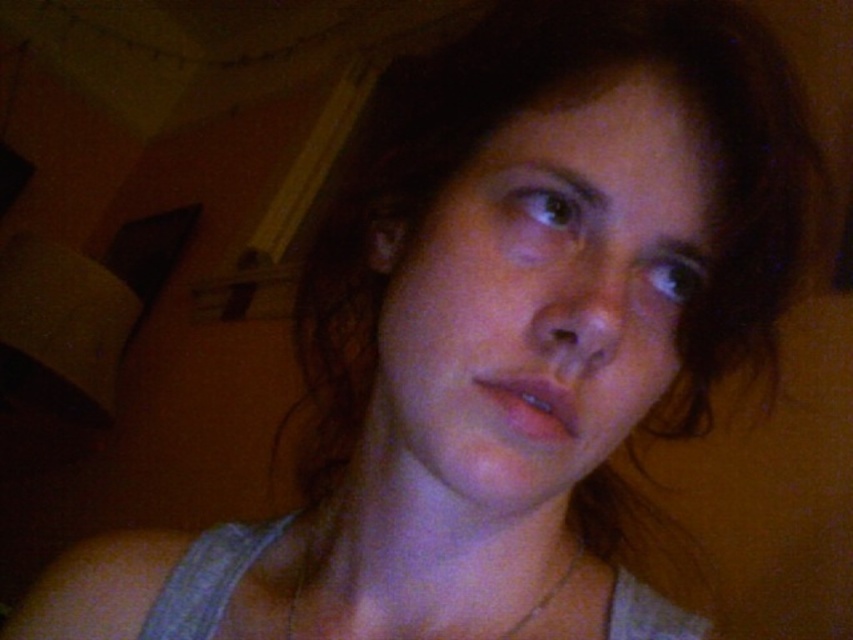
You are a photographer trying to capture a close detail shot of the silver metallic chain at center. Given that the smooth skin face at center is in the way, can you estimate whether the chain will be fully visible in the photo if you focus on the face?

The smooth skin face at center is larger in size than the silver metallic chain at center. If you focus on the face, the chain may still be visible but could be slightly out of focus depending on the camera settings. However, since the face is larger, it might block part of the chain if not positioned carefully.